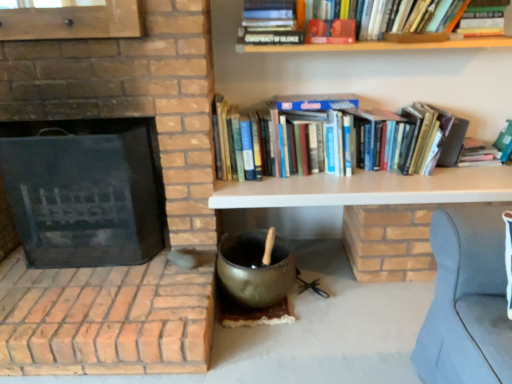
Find the location of a particular element. free space in front of black matte fireplace at left is located at coordinates (91, 302).